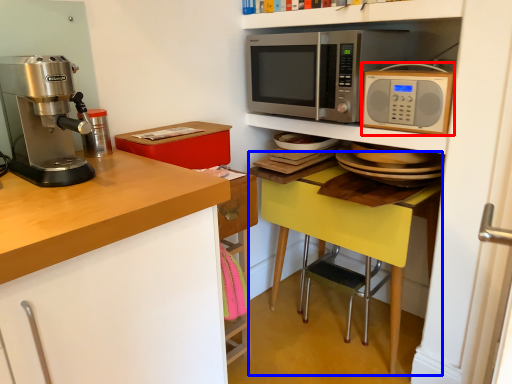
Question: Which of the following is the closest to the observer, microwave oven (highlighted by a red box) or table (highlighted by a blue box)?

Choices:
 (A) microwave oven
 (B) table

Answer: (A)